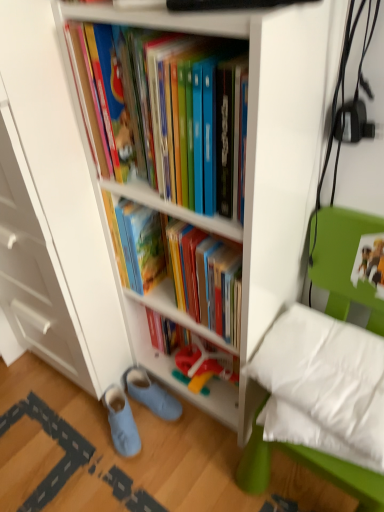
Where is `vacant space situated on the left part of blue suede slippers at lower left, the 1th footwear positioned from the right`? This screenshot has width=384, height=512. vacant space situated on the left part of blue suede slippers at lower left, the 1th footwear positioned from the right is located at coordinates (85, 425).